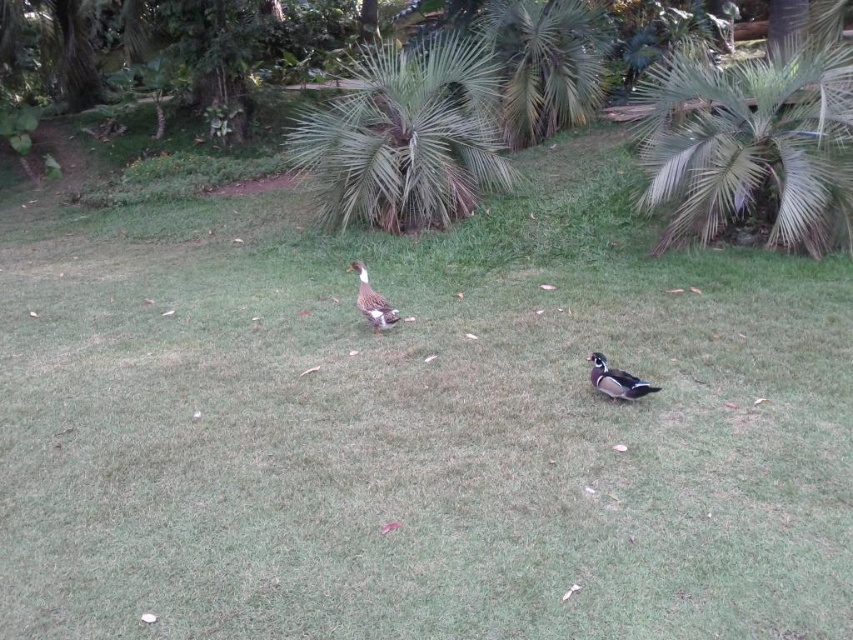
Question: Which point is farther to the camera?

Choices:
 (A) 375,292
 (B) 572,84

Answer: (B)

Question: Does green leafy palm tree at center have a larger size compared to green leafy palm tree at upper center?

Choices:
 (A) yes
 (B) no

Answer: (A)

Question: Which point is closer to the camera taking this photo?

Choices:
 (A) (643, 388)
 (B) (360, 307)
 (C) (850, 88)

Answer: (A)

Question: Can you confirm if green leafy palm tree at upper center is positioned to the right of shiny brown duck at lower right?

Choices:
 (A) no
 (B) yes

Answer: (B)

Question: Considering the real-world distances, which object is farthest from the green leafy palm tree at upper center?

Choices:
 (A) green glossy duck at center
 (B) green leafy palm tree at center
 (C) shiny brown duck at lower right

Answer: (C)

Question: Can you confirm if shiny brown duck at lower right is thinner than green glossy duck at center?

Choices:
 (A) yes
 (B) no

Answer: (B)